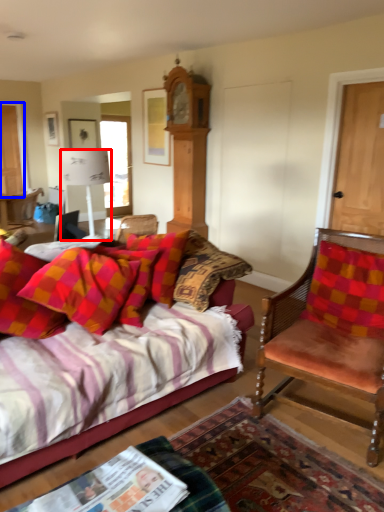
Question: Which object appears farthest to the camera in this image, lamp (highlighted by a red box) or door (highlighted by a blue box)?

Choices:
 (A) lamp
 (B) door

Answer: (B)